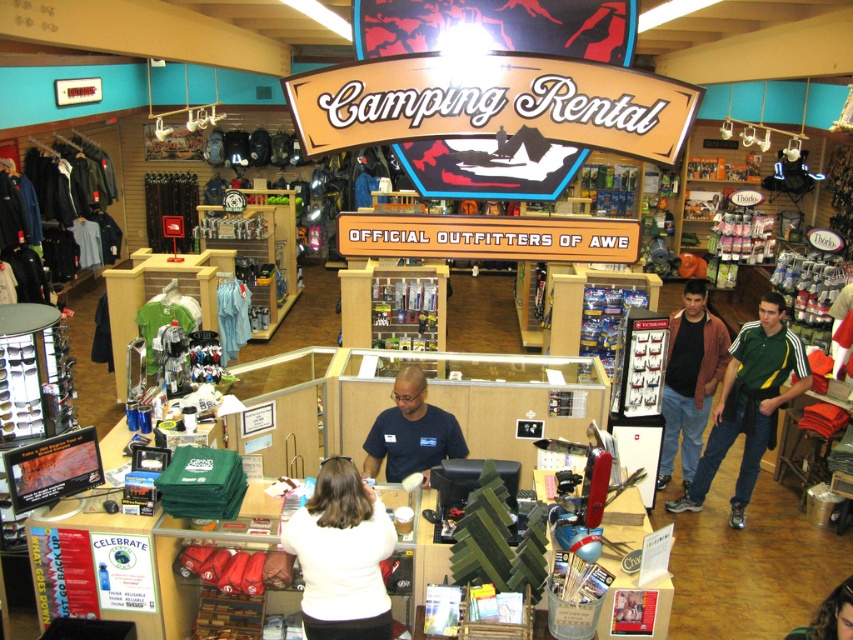
You are a customer in the store and want to ask the staff member in the brown leather jacket at lower right for help. Which direction should you walk from the white matte shirt at center to reach them?

The white matte shirt at center is to the left of the brown leather jacket at lower right, so you should walk to the right to reach the staff member in the brown leather jacket at lower right.

You are a customer in the store and want to rent a jacket. The brown leather jacket at right is located at point (x=689, y=378). The store has a policy that items must be returned within 7 days. If you check out the jacket today, on which day must you return it by?

The brown leather jacket at right must be returned by day 7.

You are a customer wanting to ask about renting a tent. You see the blue shirt at center and the brown leather jacket at lower right. Which staff member should you approach first?

You should approach the blue shirt at center first because they are closer to you than the brown leather jacket at lower right, as the blue shirt at center is further to the viewer.